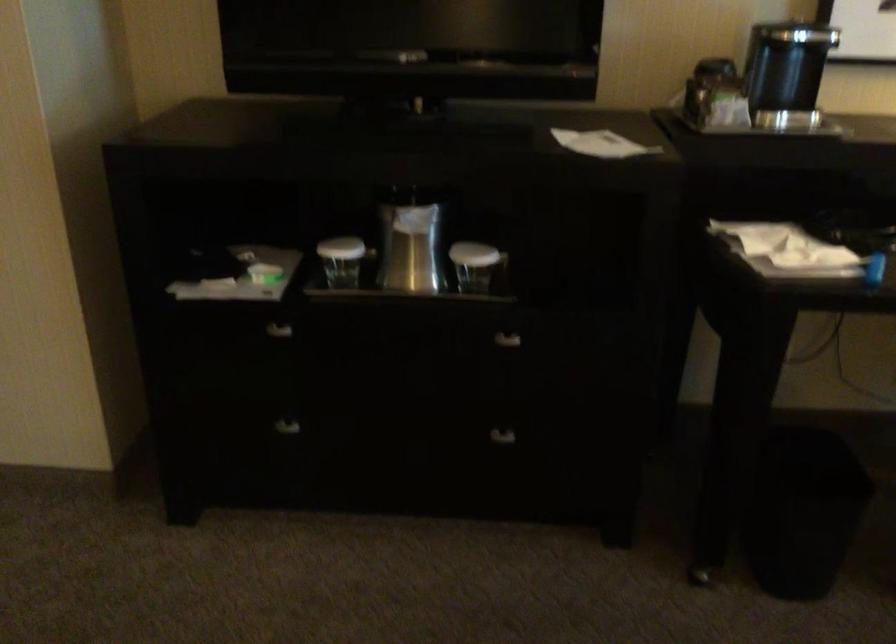
Where is `coffee maker lid`? The width and height of the screenshot is (896, 644). coffee maker lid is located at coordinates (795, 35).